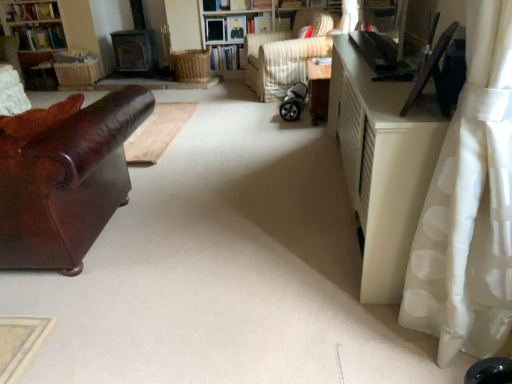
What is the approximate width of wooden table at center?

It is 10.26 inches.

Measure the distance between shiny brown leather couch at left and camera.

A distance of 1.69 meters exists between shiny brown leather couch at left and camera.

This screenshot has height=384, width=512. I want to click on shiny brown leather couch at left, so click(x=67, y=183).

Measure the distance between point (223, 12) and camera.

20.44 feet.

Identify the location of white polka dot fabric at right. This screenshot has width=512, height=384. click(x=470, y=205).

Describe the element at coordinates (470, 205) in the screenshot. I see `white polka dot fabric at right` at that location.

Where is `woven wicker bookshelf at upper left`? This screenshot has height=384, width=512. woven wicker bookshelf at upper left is located at coordinates (33, 24).

Is woven wicker bookshelf at upper left located outside white polka dot fabric at right?

That's correct, woven wicker bookshelf at upper left is outside of white polka dot fabric at right.

Who is bigger, woven wicker bookshelf at upper left or white polka dot fabric at right?

With larger size is woven wicker bookshelf at upper left.

Is woven wicker bookshelf at upper left wider than white polka dot fabric at right?

Correct, the width of woven wicker bookshelf at upper left exceeds that of white polka dot fabric at right.

Is woven wicker bookshelf at upper left in front of or behind white polka dot fabric at right in the image?

woven wicker bookshelf at upper left is positioned farther from the viewer than white polka dot fabric at right.

From a real-world perspective, is wooden bookshelf at center above or below wooden table at center?

Answer: wooden bookshelf at center is above wooden table at center.

Is wooden table at center completely or partially inside wooden bookshelf at center?

No, wooden bookshelf at center does not contain wooden table at center.

Can you tell me how much wooden bookshelf at center and wooden table at center differ in facing direction?

wooden bookshelf at center and wooden table at center are facing 90.8 degrees away from each other.

Can you confirm if wooden bookshelf at center is wider than wooden table at center?

Correct, the width of wooden bookshelf at center exceeds that of wooden table at center.

Considering the points (273, 26) and (495, 45), which point is behind, point (273, 26) or point (495, 45)?

The point (273, 26) is behind.

Could you tell me if wooden bookshelf at center is turned towards white polka dot fabric at right?

Yes, wooden bookshelf at center is aimed at white polka dot fabric at right.

Does wooden bookshelf at center have a lesser height compared to white polka dot fabric at right?

Yes.

Relative to silver metallic baby carriage at center, is shiny brown leather couch at left in front or behind?

Visually, shiny brown leather couch at left is located in front of silver metallic baby carriage at center.

Is silver metallic baby carriage at center surrounded by shiny brown leather couch at left?

No, silver metallic baby carriage at center is not a part of shiny brown leather couch at left.

Is shiny brown leather couch at left aimed at silver metallic baby carriage at center?

No.

Does point (85, 236) lie in front of point (289, 95)?

Yes, point (85, 236) is closer to viewer.

Is shiny brown leather couch at left inside the boundaries of white matte cabinet at right, or outside?

shiny brown leather couch at left is outside white matte cabinet at right.

In the image, is shiny brown leather couch at left positioned in front of or behind white matte cabinet at right?

shiny brown leather couch at left is behind white matte cabinet at right.

Based on the photo, which is more to the right, shiny brown leather couch at left or white matte cabinet at right?

From the viewer's perspective, white matte cabinet at right appears more on the right side.

What are the coordinates of `bookshelf positioned vertically above the silver metallic baby carriage at center (from a real-world perspective)` in the screenshot? It's located at (33, 24).

Which point is more distant from viewer, (301, 99) or (7, 3)?

Positioned behind is point (7, 3).

Does silver metallic baby carriage at center touch woven wicker bookshelf at upper left?

No, silver metallic baby carriage at center is not next to woven wicker bookshelf at upper left.

Is silver metallic baby carriage at center facing towards wooden bookshelf at center?

No, silver metallic baby carriage at center is not oriented towards wooden bookshelf at center.

From the image's perspective, is silver metallic baby carriage at center beneath wooden bookshelf at center?

Yes, from the image's perspective, silver metallic baby carriage at center is below wooden bookshelf at center.

Is silver metallic baby carriage at center at the left side of wooden bookshelf at center?

Incorrect, silver metallic baby carriage at center is not on the left side of wooden bookshelf at center.

Is wooden bookshelf at center located within silver metallic baby carriage at center?

No.

Locate an element on the screen. curtain located below the woven wicker bookshelf at upper left (from the image's perspective) is located at coordinates (470, 205).

Find the location of a particular element. The height and width of the screenshot is (384, 512). table below the wooden bookshelf at center (from a real-world perspective) is located at coordinates (318, 90).

Estimate the real-world distances between objects in this image. Which object is closer to shiny brown leather couch at left, white matte cabinet at right or wooden table at center?

white matte cabinet at right is closer to shiny brown leather couch at left.

Based on their spatial positions, is shiny brown leather couch at left or striped fabric chair at center further from wooden bookshelf at center?

Among the two, shiny brown leather couch at left is located further to wooden bookshelf at center.

Based on their spatial positions, is wooden bookshelf at center or shiny brown leather couch at left further from wooden table at center?

wooden bookshelf at center is further to wooden table at center.

Based on their spatial positions, is wooden bookshelf at center or shiny brown leather couch at left closer to striped fabric chair at center?

The object closer to striped fabric chair at center is wooden bookshelf at center.

When comparing their distances from white polka dot fabric at right, does wooden bookshelf at center or shiny brown leather couch at left seem closer?

The object closer to white polka dot fabric at right is shiny brown leather couch at left.

Looking at the image, which one is located closer to white matte cabinet at right, wooden table at center or silver metallic baby carriage at center?

Based on the image, wooden table at center appears to be nearer to white matte cabinet at right.

From the image, which object appears to be nearer to white polka dot fabric at right, white matte cabinet at right or silver metallic baby carriage at center?

Among the two, white matte cabinet at right is located nearer to white polka dot fabric at right.

When comparing their distances from wooden table at center, does white polka dot fabric at right or striped fabric chair at center seem closer?

Among the two, striped fabric chair at center is located nearer to wooden table at center.

The width and height of the screenshot is (512, 384). I want to click on cabinetry between white polka dot fabric at right and wooden table at center along the z-axis, so click(x=382, y=164).

At what (x,y) coordinates should I click in order to perform the action: click on table between white polka dot fabric at right and woven wicker bookshelf at upper left in the front-back direction. Please return your answer as a coordinate pair (x, y). Looking at the image, I should click on (318, 90).

Where is `shelf between woven wicker bookshelf at upper left and silver metallic baby carriage at center`? This screenshot has width=512, height=384. shelf between woven wicker bookshelf at upper left and silver metallic baby carriage at center is located at coordinates (x=232, y=17).

Locate an element on the screen. The height and width of the screenshot is (384, 512). table between white polka dot fabric at right and silver metallic baby carriage at center from front to back is located at coordinates (318, 90).